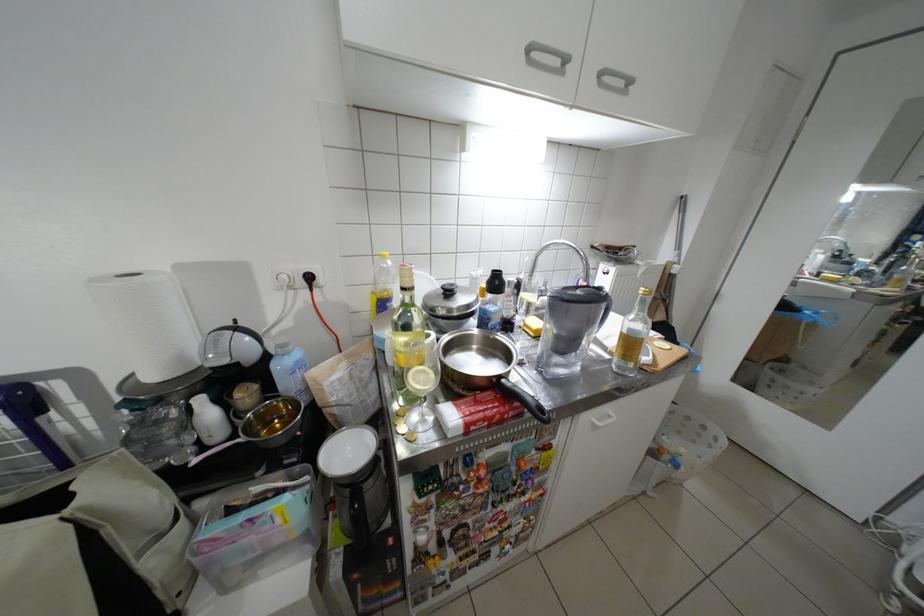
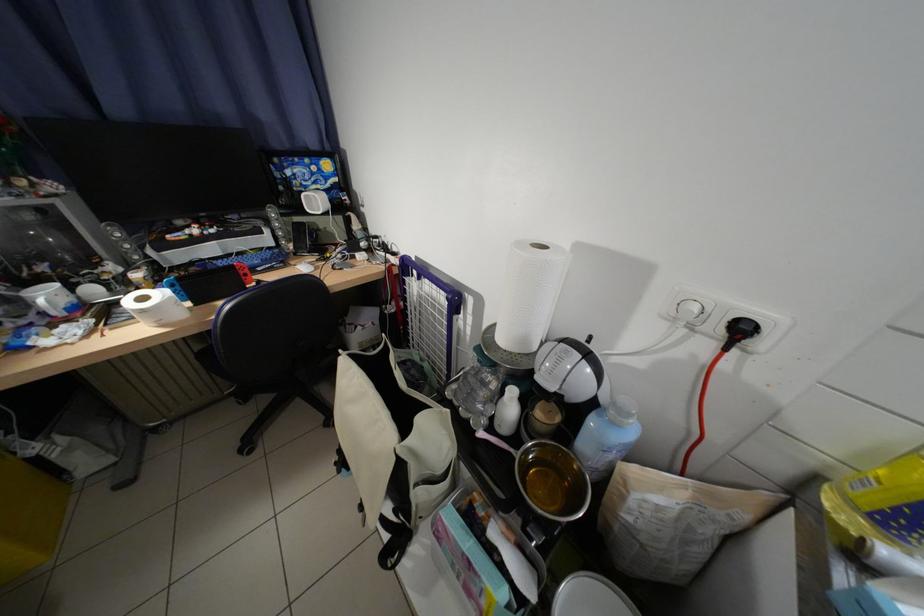
The point at (200, 411) is marked in the first image. Where is the corresponding point in the second image?

(514, 392)